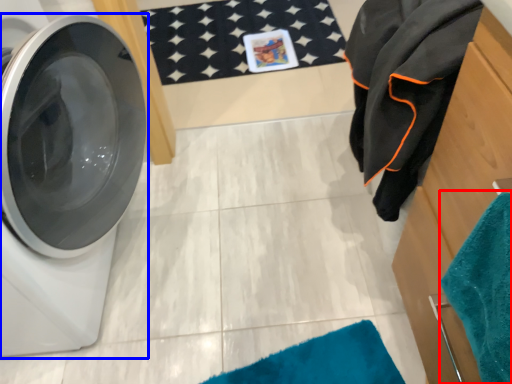
Question: Which object appears closest to the camera in this image, beach towel (highlighted by a red box) or washing machine (highlighted by a blue box)?

Choices:
 (A) beach towel
 (B) washing machine

Answer: (A)